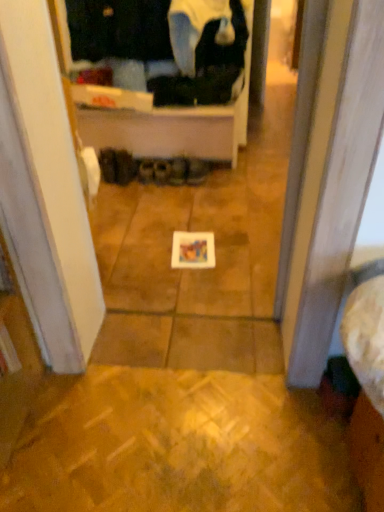
This screenshot has width=384, height=512. What are the coordinates of `vacant area that is in front of black fabric shoes at center, the 3th footwear when ordered from left to right` in the screenshot? It's located at (147, 190).